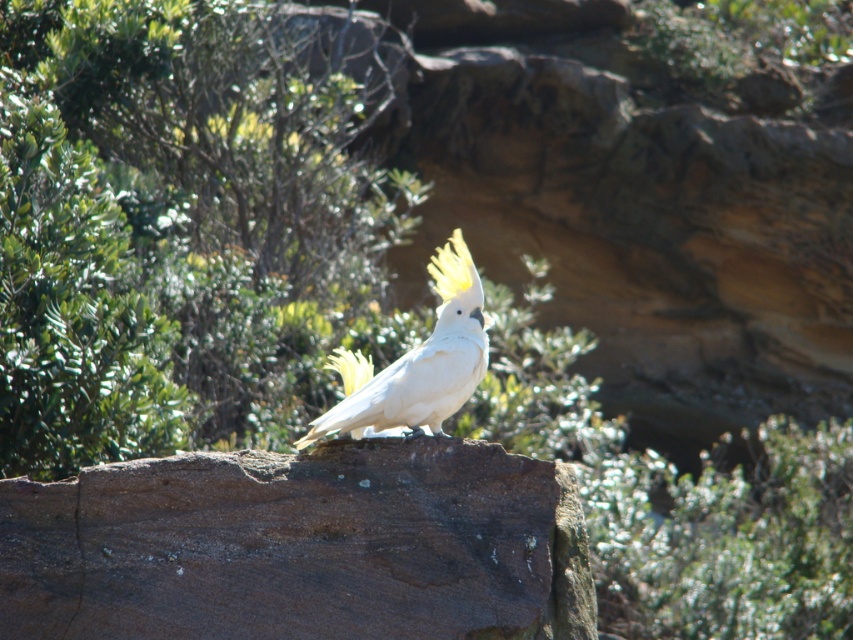
Question: Among these points, which one is nearest to the camera?

Choices:
 (A) (170, 157)
 (B) (67, 582)
 (C) (352, 403)

Answer: (B)

Question: Can you confirm if green leafy shrub at center is positioned above brown rough rock at center?

Choices:
 (A) no
 (B) yes

Answer: (B)

Question: Is brown rough rock at center smaller than white feathered cockatoo at center?

Choices:
 (A) no
 (B) yes

Answer: (A)

Question: Which point is farther from the camera taking this photo?

Choices:
 (A) (109, 497)
 (B) (364, 412)
 (C) (160, 26)

Answer: (C)

Question: Among these objects, which one is farthest from the camera?

Choices:
 (A) brown rough rock at center
 (B) white feathered cockatoo at center
 (C) green leafy shrub at center

Answer: (C)

Question: Can you confirm if green leafy shrub at center is smaller than brown rough rock at center?

Choices:
 (A) yes
 (B) no

Answer: (A)